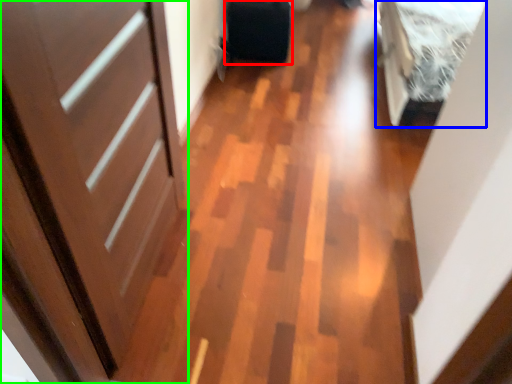
Question: Which object is positioned closest to luggage (highlighted by a red box)? Select from bed (highlighted by a blue box) and door (highlighted by a green box).

Choices:
 (A) bed
 (B) door

Answer: (A)